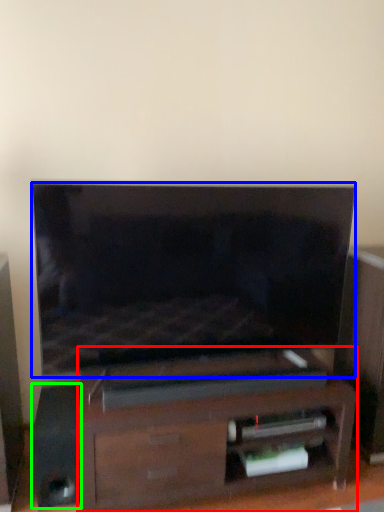
Question: Which object is positioned farthest from furniture (highlighted by a red box)? Select from television (highlighted by a blue box) and speaker (highlighted by a green box).

Choices:
 (A) television
 (B) speaker

Answer: (B)